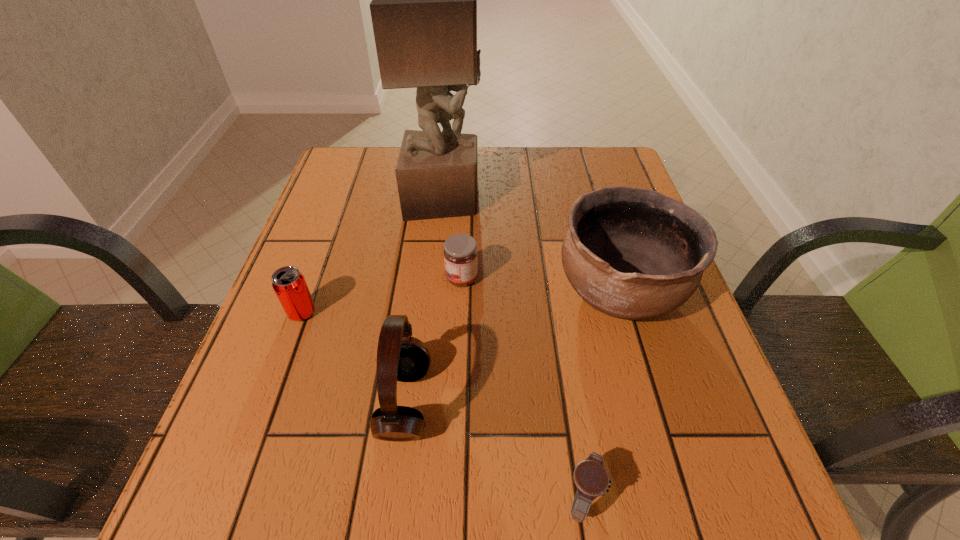
Identify the location of free point located on the back of the pottery. The width and height of the screenshot is (960, 540). (599, 224).

Identify the location of vacant region located on the back of the soda can. This screenshot has width=960, height=540. (324, 251).

Locate an element on the screen. The height and width of the screenshot is (540, 960). vacant space situated on the right of the jam is located at coordinates (635, 278).

The width and height of the screenshot is (960, 540). Find the location of `free region located on the back of the shortest object`. free region located on the back of the shortest object is located at coordinates (551, 293).

The image size is (960, 540). What are the coordinates of `object that is at the far edge` in the screenshot? It's located at (424, 0).

I want to click on object at the near edge, so click(590, 477).

The image size is (960, 540). I want to click on object located in the left edge section of the desktop, so click(289, 284).

Identify the location of object positioned at the right edge. (631, 253).

Locate an element on the screen. The width and height of the screenshot is (960, 540). vacant space at the far edge of the desktop is located at coordinates (567, 174).

At what (x,y) coordinates should I click in order to perform the action: click on free space at the near edge. Please return your answer as a coordinate pair (x, y). The image size is (960, 540). Looking at the image, I should click on (542, 503).